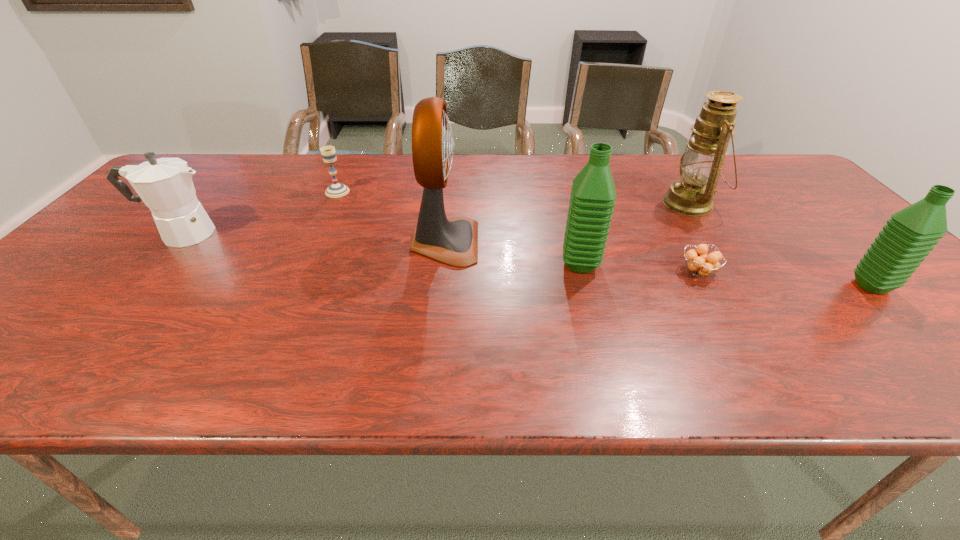
Identify the location of vacant region that satisfies the following two spatial constraints: 1. at the spout of the leftmost object; 2. on the left side of the rightmost object. (136, 286).

Identify the location of free spot that satisfies the following two spatial constraints: 1. on the front-facing side of the fan; 2. on the left side of the right water bottle. This screenshot has height=540, width=960. (441, 286).

Where is `vacant area that satisfies the following two spatial constraints: 1. on the back side of the oil lamp; 2. on the right side of the orange fruit`? Image resolution: width=960 pixels, height=540 pixels. vacant area that satisfies the following two spatial constraints: 1. on the back side of the oil lamp; 2. on the right side of the orange fruit is located at coordinates (660, 204).